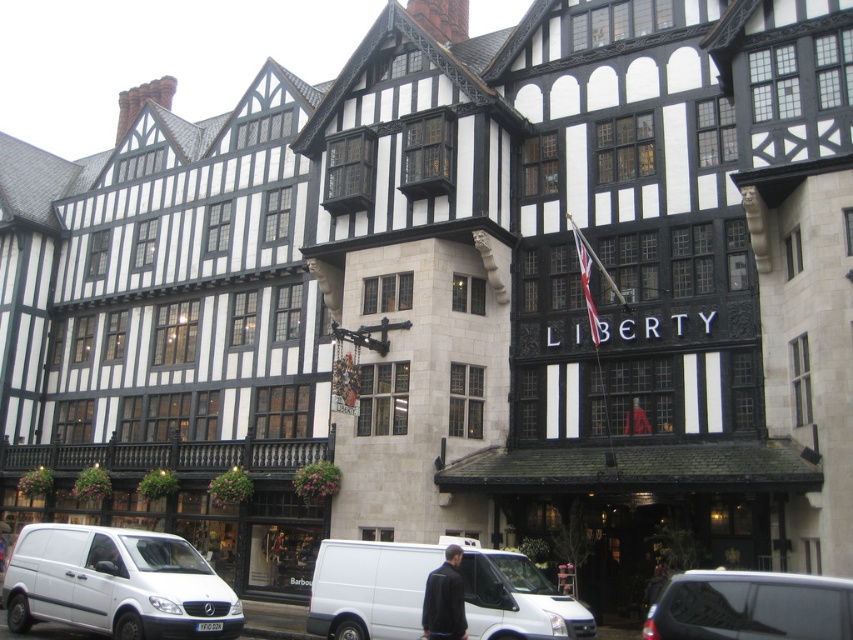
Can you confirm if white matte van at lower left is smaller than dark blue jacket at center?

No, white matte van at lower left is not smaller than dark blue jacket at center.

Is white matte van at lower left thinner than dark blue jacket at center?

No.

Identify the location of white matte van at lower left. This screenshot has height=640, width=853. (115, 582).

Find the location of a particular element. white matte van at lower left is located at coordinates (115, 582).

Is point (686, 573) in front of point (437, 572)?

Yes.

Which is behind, point (770, 589) or point (428, 618)?

Positioned behind is point (428, 618).

Where is `metallic silver van at center`? This screenshot has height=640, width=853. metallic silver van at center is located at coordinates (751, 605).

Which is in front, point (77, 568) or point (531, 616)?

Point (531, 616)

Can you confirm if white matte van at lower left is thinner than white matte van at center?

In fact, white matte van at lower left might be wider than white matte van at center.

Who is more distant from viewer, (x=45, y=580) or (x=345, y=589)?

The point (x=45, y=580) is behind.

This screenshot has height=640, width=853. Find the location of `white matte van at lower left`. white matte van at lower left is located at coordinates pos(115,582).